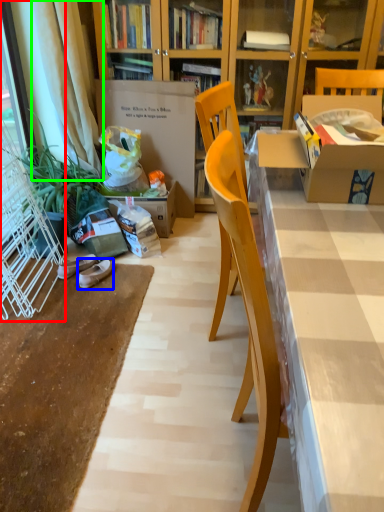
Question: Which is nearer to the screen door (highlighted by a red box)? footwear (highlighted by a blue box) or curtain (highlighted by a green box).

Choices:
 (A) footwear
 (B) curtain

Answer: (A)